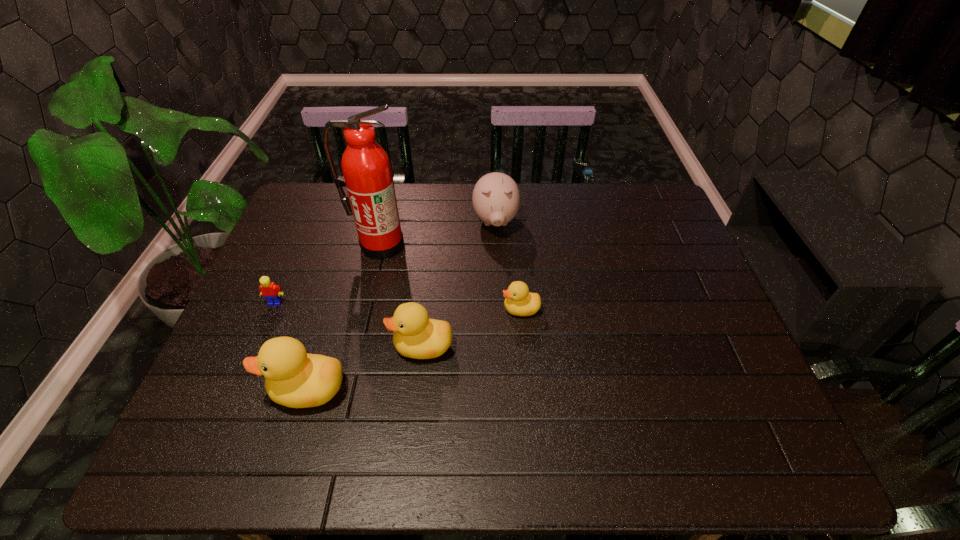
This screenshot has height=540, width=960. Find the location of `object that stands as the third closest to the second nearest object`. object that stands as the third closest to the second nearest object is located at coordinates (367, 175).

Choose which object is the third nearest neighbor to the Lego. Please provide its 2D coordinates. Your answer should be formatted as a tuple, i.e. [(x, y)], where the tuple contains the x and y coordinates of a point satisfying the conditions above.

[(416, 336)]

This screenshot has width=960, height=540. In order to click on duckling that is the second closest one to the fire extinguisher in this screenshot , I will do `click(519, 301)`.

Locate an element on the screen. The height and width of the screenshot is (540, 960). duckling that stands as the second closest to the shortest duckling is located at coordinates (294, 378).

What are the coordinates of `free location that satisfies the following two spatial constraints: 1. at the snout of the piggy bank; 2. on the face of the leftmost duckling` in the screenshot? It's located at (502, 389).

The height and width of the screenshot is (540, 960). Identify the location of free point that satisfies the following two spatial constraints: 1. at the snout of the piggy bank; 2. on the face of the second farthest duckling. (500, 346).

At what (x,y) coordinates should I click in order to perform the action: click on blank area in the image that satisfies the following two spatial constraints: 1. on the label side of the fire extinguisher; 2. on the face of the leftmost duckling. Please return your answer as a coordinate pair (x, y). Image resolution: width=960 pixels, height=540 pixels. Looking at the image, I should click on (347, 389).